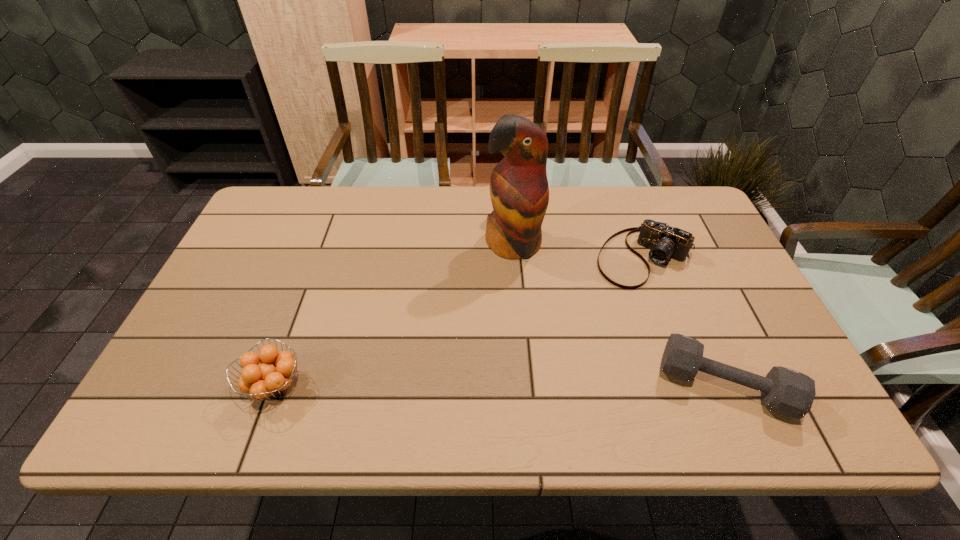
At what (x,y) coordinates should I click in order to perform the action: click on orange fruit. Please return your answer as a coordinate pair (x, y). The width and height of the screenshot is (960, 540). Looking at the image, I should click on (273, 376).

You are a GUI agent. You are given a task and a screenshot of the screen. Output one action in this format:
    pyautogui.click(x=<x>, y=<y>)
    Task: Click on the dumbbell
    The height and width of the screenshot is (540, 960).
    Given the screenshot: What is the action you would take?
    pyautogui.click(x=784, y=391)

Locate an element on the screen. This screenshot has height=540, width=960. the tallest object is located at coordinates (519, 190).

Locate an element on the screen. parrot is located at coordinates (519, 190).

Image resolution: width=960 pixels, height=540 pixels. I want to click on camera, so click(x=665, y=242).

This screenshot has width=960, height=540. What are the coordinates of `vacant space located on the right of the orange fruit` in the screenshot? It's located at (472, 386).

At what (x,y) coordinates should I click in order to perform the action: click on free space located 0.360m on the back of the dumbbell. Please return your answer as a coordinate pair (x, y). Looking at the image, I should click on (665, 247).

At what (x,y) coordinates should I click in order to perform the action: click on free location located 0.280m on the face of the tallest object. Please return your answer as a coordinate pair (x, y). The image size is (960, 540). Looking at the image, I should click on (537, 349).

Find the location of `vacant area located on the face of the tallest object`. vacant area located on the face of the tallest object is located at coordinates (528, 310).

I want to click on vacant space located 0.160m on the face of the tallest object, so click(x=528, y=310).